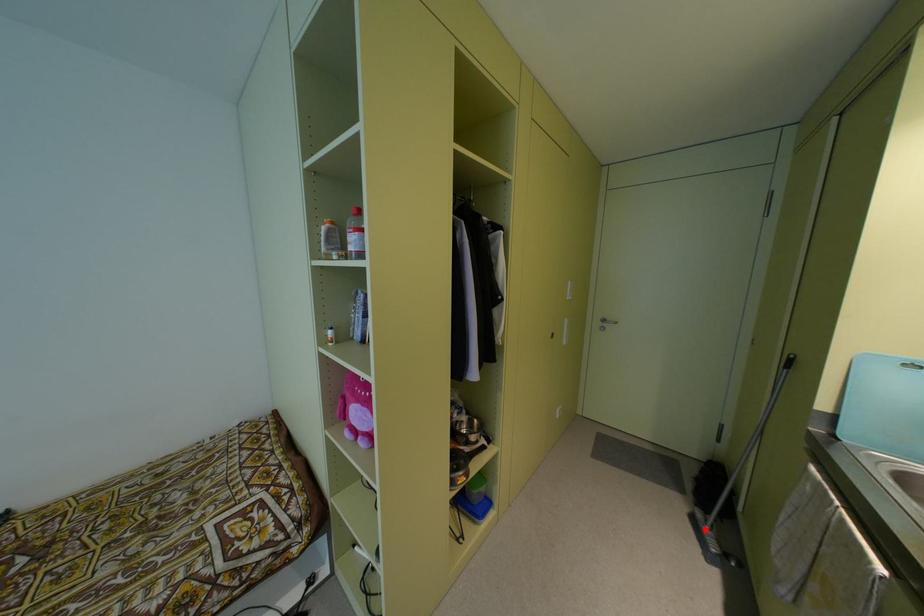
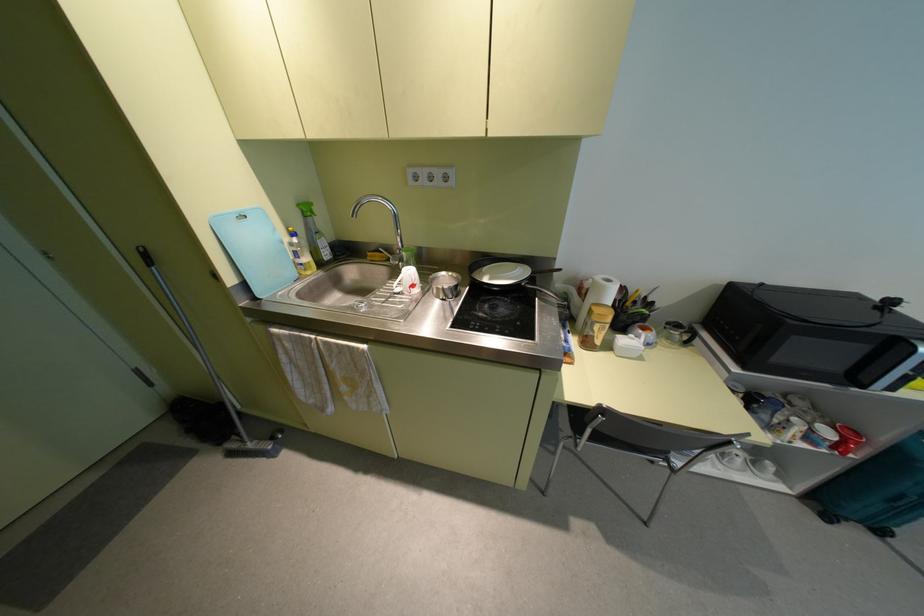
Where in the second image is the point corresponding to the highlighted location from the first image?

(250, 445)